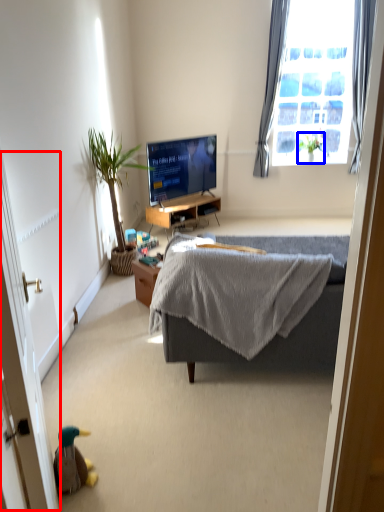
Question: Which point is closer to the camera, screen door (highlighted by a red box) or houseplant (highlighted by a blue box)?

Choices:
 (A) screen door
 (B) houseplant

Answer: (A)